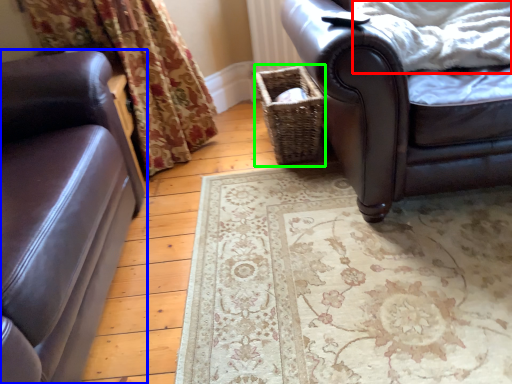
Question: Considering the real-world distances, which object is closest to blanket (highlighted by a red box)? studio couch (highlighted by a blue box) or basket (highlighted by a green box).

Choices:
 (A) studio couch
 (B) basket

Answer: (B)